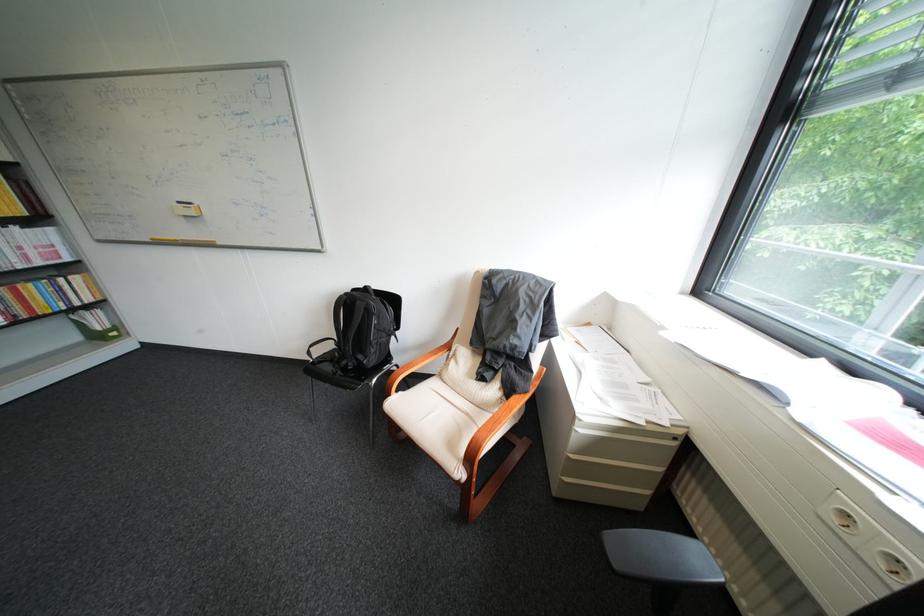
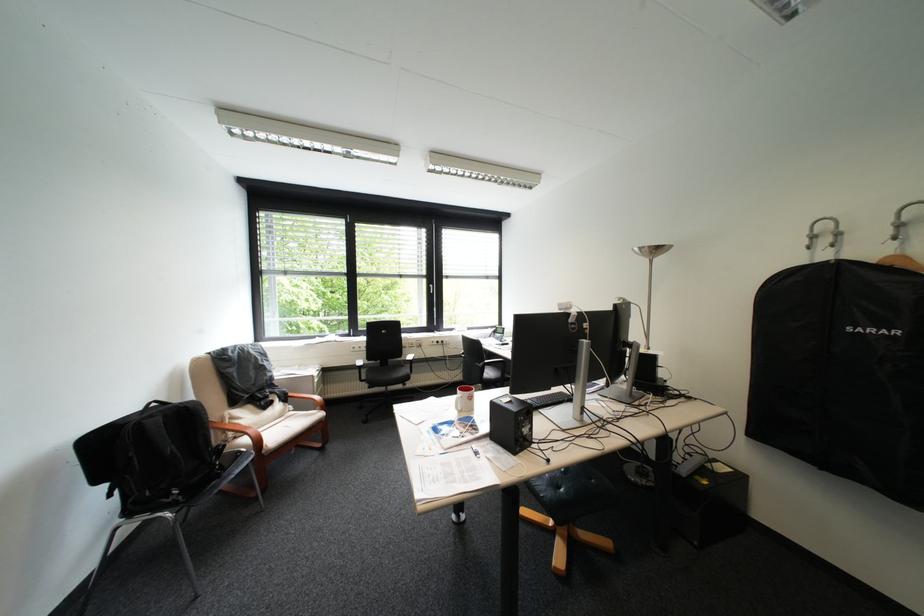
In the second image, find the point that corresponds to the point at 370,302 in the first image.

(199, 407)